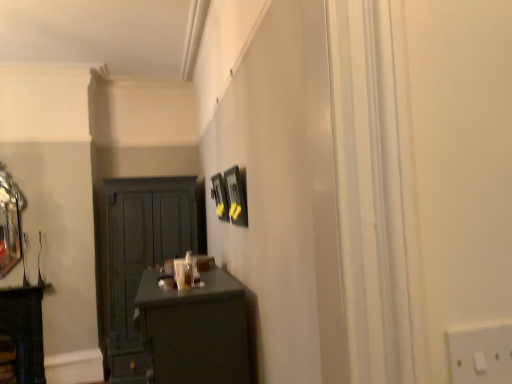
The height and width of the screenshot is (384, 512). I want to click on matte dark wood cabinet at left, so click(24, 330).

What is the approximate height of matte black picture frame at upper center, the 1th picture frame from the back?

matte black picture frame at upper center, the 1th picture frame from the back, is 35.20 centimeters tall.

Image resolution: width=512 pixels, height=384 pixels. I want to click on matte black desk at lower left, so click(195, 330).

What is the approximate width of matte black desk at lower left?

21.71 inches.

Where is `polished silver mirror at left`? polished silver mirror at left is located at coordinates (9, 223).

This screenshot has height=384, width=512. I want to click on matte dark wood cabinet at left, so click(x=24, y=330).

From a real-world perspective, is polished silver mirror at left on matte black desk at lower left?

Yes, from a real-world perspective, polished silver mirror at left is above matte black desk at lower left.

From the image's perspective, which is below, polished silver mirror at left or matte black desk at lower left?

matte black desk at lower left.

Is polished silver mirror at left smaller than matte black desk at lower left?

Indeed, polished silver mirror at left has a smaller size compared to matte black desk at lower left.

How much distance is there between polished silver mirror at left and matte black desk at lower left?

The distance of polished silver mirror at left from matte black desk at lower left is 8.17 feet.

Is the surface of matte dark green cupboard at left in direct contact with matte black picture frame at center, which is the first picture frame in front-to-back order?

matte dark green cupboard at left and matte black picture frame at center, which is the first picture frame in front-to-back order, are not in contact.

Between point (113, 373) and point (237, 206), which one is positioned in front?

The point (237, 206) is closer to the camera.

Does matte dark green cupboard at left appear on the right side of matte black picture frame at center, which ranks as the first picture frame in right-to-left order?

Incorrect, matte dark green cupboard at left is not on the right side of matte black picture frame at center, which ranks as the first picture frame in right-to-left order.

Is matte dark green cupboard at left aimed at matte black picture frame at center, which is the first picture frame in front-to-back order?

Yes, matte dark green cupboard at left is facing matte black picture frame at center, which is the first picture frame in front-to-back order.

Is matte black picture frame at center, positioned as the second picture frame in back-to-front order, facing away from matte dark wood cabinet at left?

That's not correct — matte black picture frame at center, positioned as the second picture frame in back-to-front order, is not looking away from matte dark wood cabinet at left.

Looking at this image, does matte black picture frame at center, which is the first picture frame in front-to-back order, come behind matte dark wood cabinet at left?

No, the depth of matte black picture frame at center, which is the first picture frame in front-to-back order, is less than that of matte dark wood cabinet at left.

Can you confirm if matte black picture frame at center, which ranks as the first picture frame in right-to-left order, is bigger than matte dark wood cabinet at left?

No.

Considering the relative sizes of matte black picture frame at center, which ranks as the first picture frame in right-to-left order, and matte dark wood cabinet at left in the image provided, is matte black picture frame at center, which ranks as the first picture frame in right-to-left order, thinner than matte dark wood cabinet at left?

Indeed, matte black picture frame at center, which ranks as the first picture frame in right-to-left order, has a lesser width compared to matte dark wood cabinet at left.

Based on the photo, is matte dark wood cabinet at left taller than matte black picture frame at center, positioned as the second picture frame in back-to-front order?

Yes, matte dark wood cabinet at left is taller than matte black picture frame at center, positioned as the second picture frame in back-to-front order.

Would you say matte dark wood cabinet at left is inside or outside matte black picture frame at center, which ranks as the first picture frame in right-to-left order?

matte dark wood cabinet at left is not enclosed by matte black picture frame at center, which ranks as the first picture frame in right-to-left order.

How different are the orientations of matte dark wood cabinet at left and matte black picture frame at center, which is the first picture frame in front-to-back order, in degrees?

matte dark wood cabinet at left and matte black picture frame at center, which is the first picture frame in front-to-back order, are facing 91 degrees away from each other.

From a real-world perspective, is matte dark wood cabinet at left over matte black picture frame at center, which ranks as the first picture frame in right-to-left order?

No, from a real-world perspective, matte dark wood cabinet at left is not on top of matte black picture frame at center, which ranks as the first picture frame in right-to-left order.

Is matte black picture frame at center, which is the first picture frame in front-to-back order, oriented towards polished silver mirror at left?

No, matte black picture frame at center, which is the first picture frame in front-to-back order, is not oriented towards polished silver mirror at left.

How different are the orientations of matte black picture frame at center, positioned as the second picture frame in back-to-front order, and polished silver mirror at left in degrees?

91 degrees.

Looking at this image, considering their positions, is matte black picture frame at center, which ranks as the first picture frame in right-to-left order, located in front of or behind polished silver mirror at left?

matte black picture frame at center, which ranks as the first picture frame in right-to-left order, is positioned closer to the viewer than polished silver mirror at left.

From a real-world perspective, relative to polished silver mirror at left, is matte black picture frame at center, which is the first picture frame in front-to-back order, vertically above or below?

Clearly, from a real-world perspective, matte black picture frame at center, which is the first picture frame in front-to-back order, is below polished silver mirror at left.

Does matte black picture frame at center, which is the first picture frame in front-to-back order, turn towards matte black desk at lower left?

No, matte black picture frame at center, which is the first picture frame in front-to-back order, is not facing towards matte black desk at lower left.

Find the location of a particular element. This screenshot has width=512, height=384. desk to the left of matte black picture frame at center, which ranks as the first picture frame in right-to-left order is located at coordinates (195, 330).

Is matte black picture frame at center, positioned as the second picture frame in back-to-front order, touching matte black desk at lower left?

No, matte black picture frame at center, positioned as the second picture frame in back-to-front order, is not in contact with matte black desk at lower left.

Looking at their sizes, would you say matte black picture frame at center, which is the second picture frame from left to right, is wider or thinner than matte black desk at lower left?

matte black picture frame at center, which is the second picture frame from left to right, is thinner than matte black desk at lower left.

Which object is wider, matte dark wood cabinet at left or matte black desk at lower left?

With larger width is matte black desk at lower left.

Is matte black desk at lower left at the back of matte dark wood cabinet at left?

No, matte dark wood cabinet at left is not facing the opposite direction of matte black desk at lower left.

Does matte dark wood cabinet at left have a greater height compared to matte black desk at lower left?

Yes.

How many degrees apart are the facing directions of matte dark wood cabinet at left and matte black desk at lower left?

The angle between the facing direction of matte dark wood cabinet at left and the facing direction of matte black desk at lower left is 90.4 degrees.

Where is `mirror that appears behind the matte black desk at lower left`? mirror that appears behind the matte black desk at lower left is located at coordinates (9, 223).

Where is `the 1st picture frame above the matte dark green cupboard at left (from a real-world perspective)`? This screenshot has height=384, width=512. the 1st picture frame above the matte dark green cupboard at left (from a real-world perspective) is located at coordinates (236, 197).

Considering their positions, is matte black desk at lower left positioned further to matte dark wood cabinet at left than matte dark green cupboard at left?

Among the two, matte black desk at lower left is located further to matte dark wood cabinet at left.

Based on their spatial positions, is matte black picture frame at upper center, the 1th picture frame from the back, or polished silver mirror at left further from matte dark wood cabinet at left?

matte black picture frame at upper center, the 1th picture frame from the back, is further to matte dark wood cabinet at left.

Considering their positions, is matte black picture frame at center, positioned as the second picture frame in back-to-front order, positioned closer to polished silver mirror at left than matte black desk at lower left?

Among the two, matte black picture frame at center, positioned as the second picture frame in back-to-front order, is located nearer to polished silver mirror at left.

Based on their spatial positions, is matte black desk at lower left or matte black picture frame at upper center, the second picture frame when ordered from right to left, further from matte dark green cupboard at left?

matte black desk at lower left lies further to matte dark green cupboard at left than the other object.

When comparing their distances from matte dark green cupboard at left, does matte black picture frame at upper center, acting as the first picture frame starting from the left, or polished silver mirror at left seem further?

matte black picture frame at upper center, acting as the first picture frame starting from the left.

Based on their spatial positions, is matte dark wood cabinet at left or polished silver mirror at left further from matte dark green cupboard at left?

Among the two, polished silver mirror at left is located further to matte dark green cupboard at left.

From the image, which object appears to be nearer to matte black desk at lower left, matte black picture frame at center, positioned as the second picture frame in back-to-front order, or matte dark green cupboard at left?

matte black picture frame at center, positioned as the second picture frame in back-to-front order, lies closer to matte black desk at lower left than the other object.

Based on their spatial positions, is matte black picture frame at upper center, acting as the first picture frame starting from the left, or matte dark wood cabinet at left further from matte dark green cupboard at left?

The object further to matte dark green cupboard at left is matte black picture frame at upper center, acting as the first picture frame starting from the left.

This screenshot has height=384, width=512. I want to click on picture frame between matte black picture frame at center, which is the first picture frame in front-to-back order, and matte black desk at lower left from top to bottom, so click(220, 197).

The image size is (512, 384). Find the location of `cupboard between matte dark wood cabinet at left and matte black picture frame at center, positioned as the second picture frame in back-to-front order, in the horizontal direction`. cupboard between matte dark wood cabinet at left and matte black picture frame at center, positioned as the second picture frame in back-to-front order, in the horizontal direction is located at coordinates (137, 259).

Where is `picture frame between polished silver mirror at left and matte black picture frame at center, which is the second picture frame from left to right`? The width and height of the screenshot is (512, 384). picture frame between polished silver mirror at left and matte black picture frame at center, which is the second picture frame from left to right is located at coordinates (220, 197).

Identify the location of desk located between matte dark wood cabinet at left and matte black picture frame at upper center, acting as the second picture frame starting from the front, in the left-right direction. The image size is (512, 384). (195, 330).